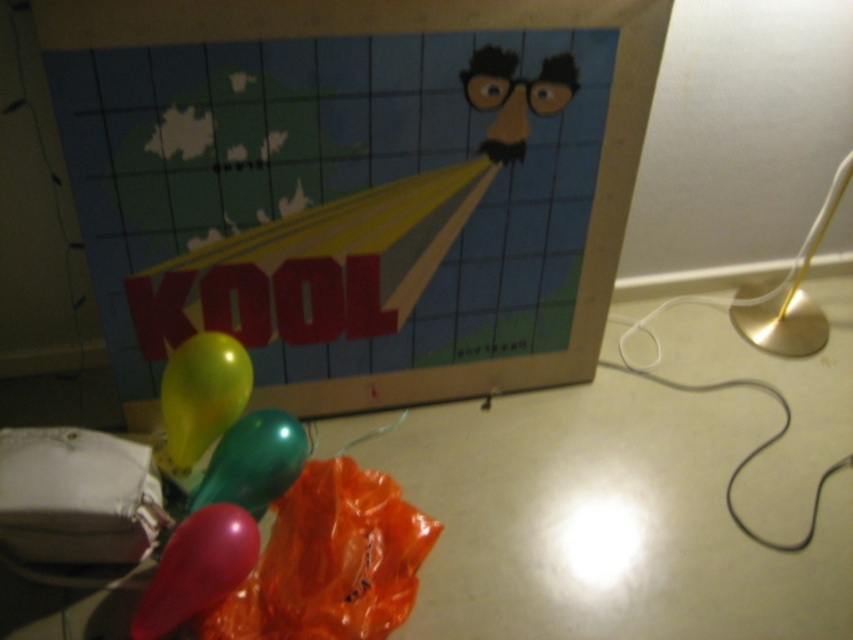
Consider the image. You are standing 5 feet away from the artwork. Is the point at coordinates point (497, 120) on the artwork closer to you than your current distance?

The distance of point (497, 120) from viewer is 4.40 feet, which is less than 5 feet, so yes, the point is closer to you than your current distance.